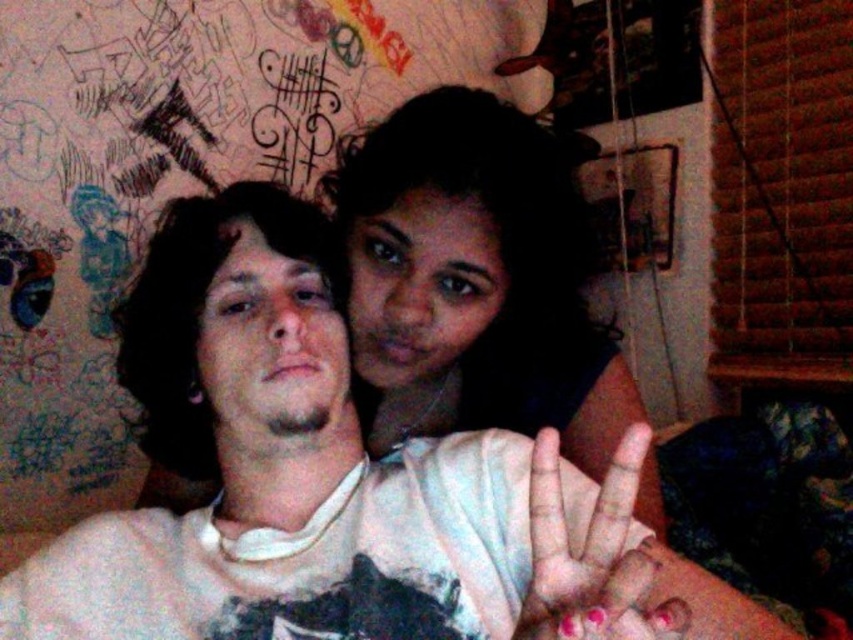
You are a photographer trying to capture a clear shot of the smooth skin face at center and the white cotton shirt at center. Since you want the face to be in focus, which object should you adjust your camera to prioritize focusing on?

The white cotton shirt at center is closer to the viewer than the smooth skin face at center, so to focus on the smooth skin face at center, you need to adjust the camera to focus on the farther object.

You are a photographer standing in front of the two people in the image. You want to take a photo where the white cotton shirt at center and the smooth skin face at center are both clearly visible. Based on their current positions, which object should you adjust to ensure both are visible?

The white cotton shirt at center is to the left of the smooth skin face at center. To ensure both are visible, you should adjust the smooth skin face at center to move it slightly to the right so there is space between them.

You are a photographer trying to capture the smooth skin face at center in the image. The camera you are using has a focus point at coordinate point (x=474, y=280). Will this focus point successfully capture the smooth skin face at center?

Yes, the point (x=474, y=280) marks the smooth skin face at center, so the focus point will successfully capture it.